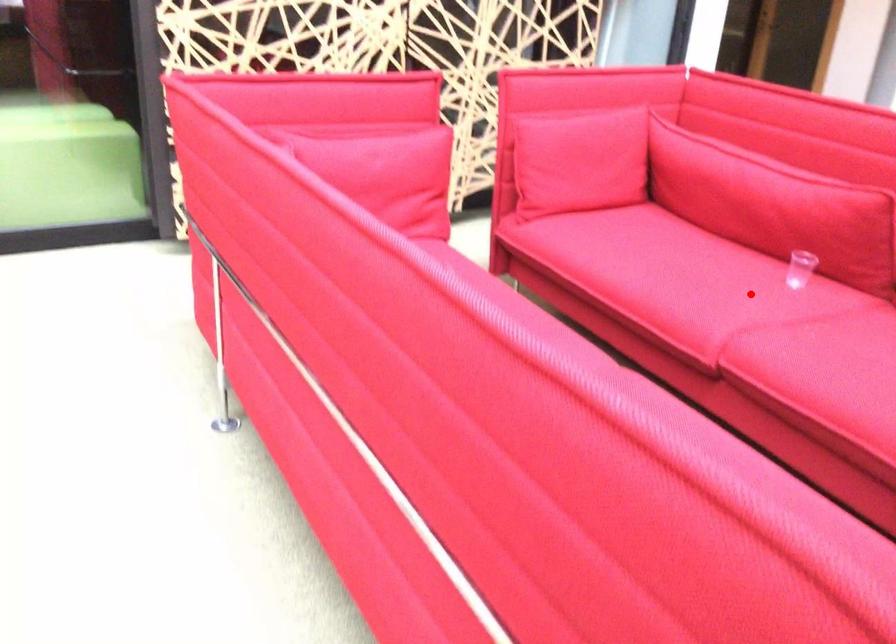
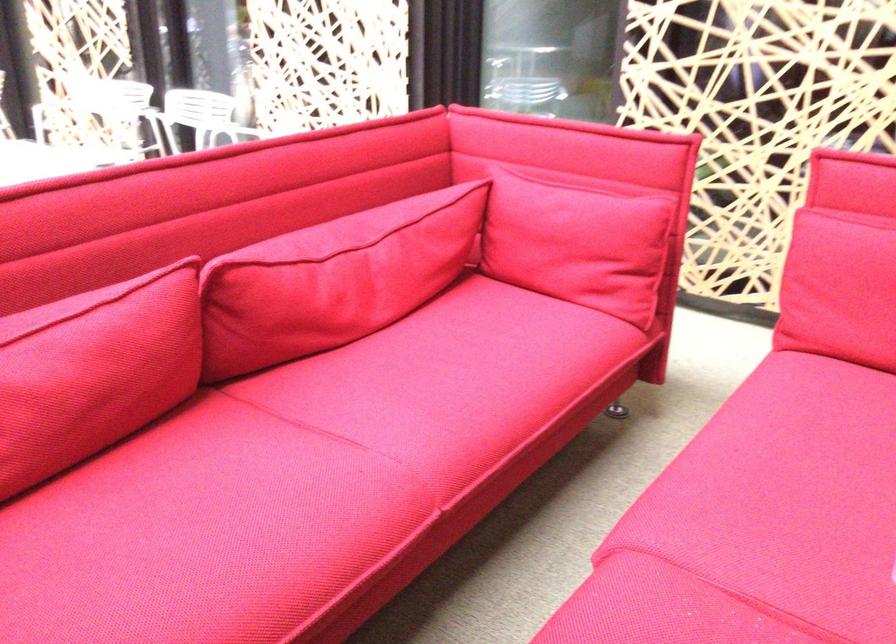
Question: A red point is marked in image1. In image2, is the corresponding 3D point closer to the camera or farther? Reply with the corresponding letter.

Choices:
 (A) The corresponding 3D point is closer.
 (B) The corresponding 3D point is farther.

Answer: (A)